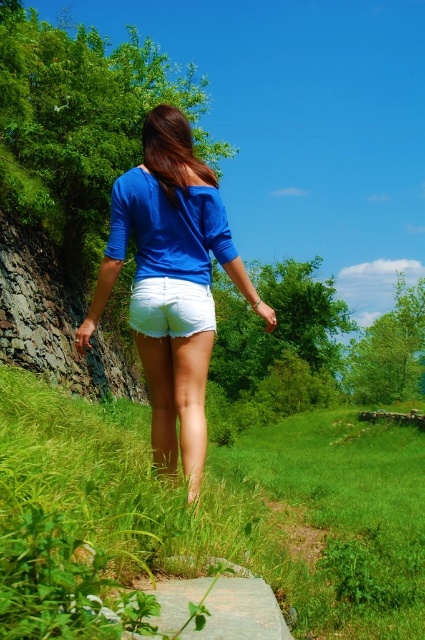
Is green grassy at lower left below rustic stone cliff at left?

Correct, green grassy at lower left is located below rustic stone cliff at left.

From the picture: Does green grassy at lower left have a greater height compared to rustic stone cliff at left?

Correct, green grassy at lower left is much taller as rustic stone cliff at left.

Which is behind, point (98, 456) or point (127, 392)?

The point (127, 392) is more distant.

Locate an element on the screen. green grassy at lower left is located at coordinates (240, 500).

Which is behind, point (198, 468) or point (13, 348)?

Positioned behind is point (13, 348).

Is matte blue shirt at center shorter than rustic stone cliff at left?

Yes.

Where is `matte blue shirt at center`? The image size is (425, 640). matte blue shirt at center is located at coordinates (169, 220).

I want to click on matte blue shirt at center, so click(169, 220).

How distant is matte blue shirt at center from white cotton shorts at center?

A distance of 9.63 inches exists between matte blue shirt at center and white cotton shorts at center.

Does matte blue shirt at center come in front of white cotton shorts at center?

Yes, matte blue shirt at center is closer to the viewer.

This screenshot has width=425, height=640. I want to click on matte blue shirt at center, so click(x=169, y=220).

The width and height of the screenshot is (425, 640). I want to click on matte blue shirt at center, so click(x=169, y=220).